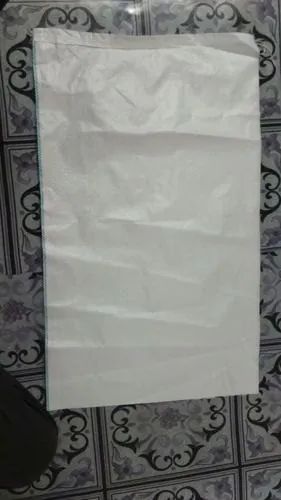
I want to click on floor, so click(x=172, y=421).